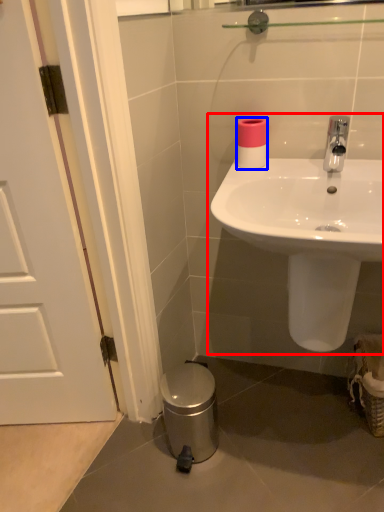
Question: Which of the following is the farthest to the observer, sink (highlighted by a red box) or toilet paper (highlighted by a blue box)?

Choices:
 (A) sink
 (B) toilet paper

Answer: (B)